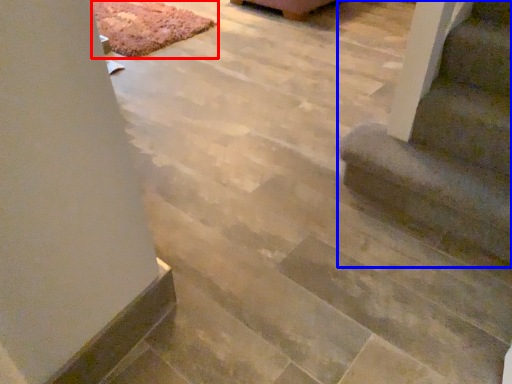
Question: Which object appears farthest to the camera in this image, mat (highlighted by a red box) or stairs (highlighted by a blue box)?

Choices:
 (A) mat
 (B) stairs

Answer: (A)